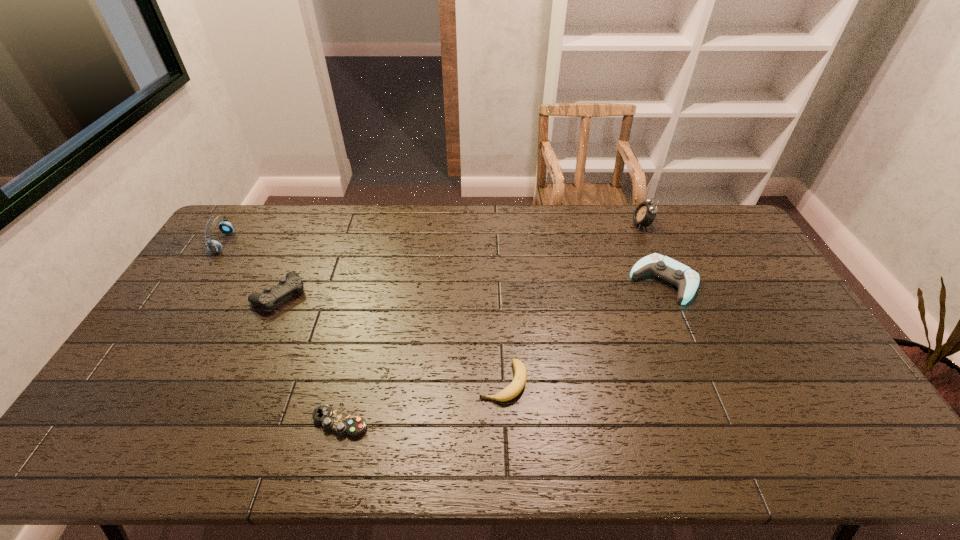
This screenshot has width=960, height=540. Identify the location of vacant region located on the face of the alarm clock. (598, 225).

The image size is (960, 540). Find the location of `vacant space situated on the ear cups of the leftmost object`. vacant space situated on the ear cups of the leftmost object is located at coordinates (289, 242).

Image resolution: width=960 pixels, height=540 pixels. I want to click on vacant space situated 0.120m on the front of the second object from left to right, so click(x=256, y=346).

Where is `vacant region located 0.170m on the left of the rightmost control`? Image resolution: width=960 pixels, height=540 pixels. vacant region located 0.170m on the left of the rightmost control is located at coordinates (580, 282).

This screenshot has width=960, height=540. I want to click on vacant space located 0.200m on the left of the second nearest object, so click(404, 382).

I want to click on blank space located on the back of the second control from left to right, so click(x=368, y=310).

Where is `alarm clock that is at the far edge`? Image resolution: width=960 pixels, height=540 pixels. alarm clock that is at the far edge is located at coordinates (645, 213).

Locate an element on the screen. The image size is (960, 540). headset located at the far edge is located at coordinates (214, 246).

The width and height of the screenshot is (960, 540). Identify the location of object located in the near edge section of the desktop. (330, 419).

This screenshot has height=540, width=960. What are the coordinates of `object located in the left edge section of the desktop` in the screenshot? It's located at (214, 246).